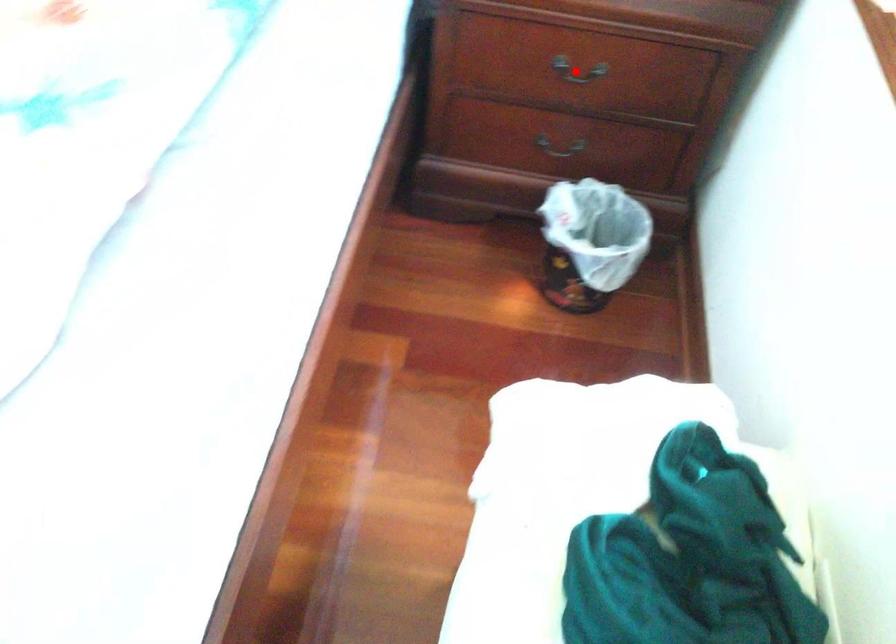
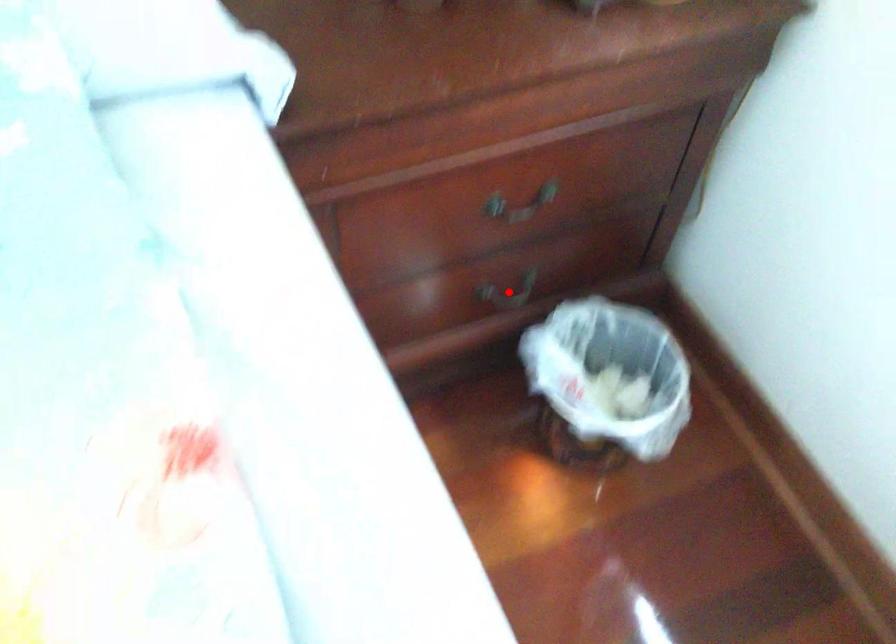
I am providing you with two images of the same scene from different viewpoints. A red point is marked on the first image and another point is marked on the second image. Is the red point in image1 aligned with the point shown in image2?

No